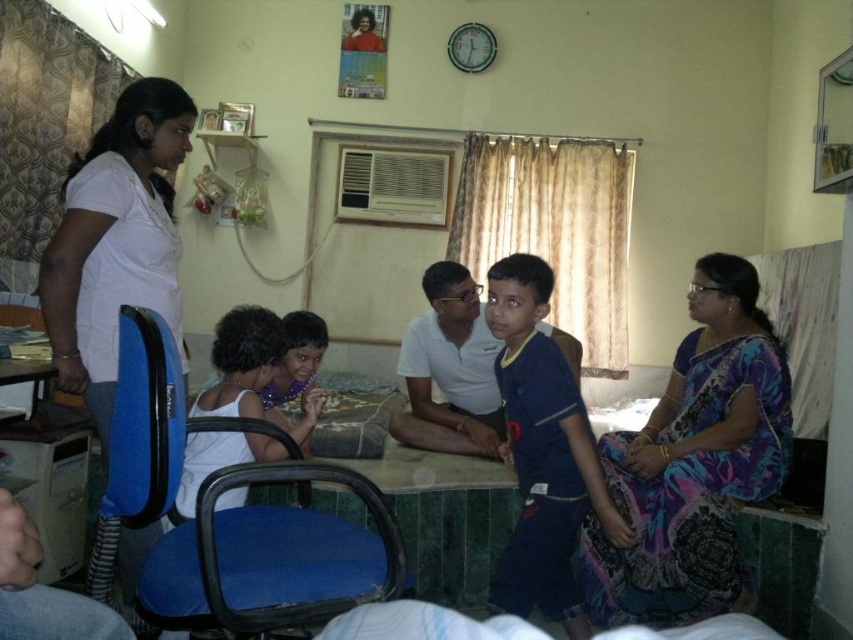
Who is shorter, printed silk saree at lower right or green marble table at center?

green marble table at center is shorter.

Does point (611, 476) come in front of point (430, 456)?

Yes, point (611, 476) is in front of point (430, 456).

You are a GUI agent. You are given a task and a screenshot of the screen. Output one action in this format:
    pyautogui.click(x=<x>, y=<y>)
    Task: Click on the printed silk saree at lower right
    Image resolution: width=853 pixels, height=640 pixels.
    Given the screenshot: What is the action you would take?
    pyautogui.click(x=694, y=461)

Is green marble table at center bigger than matte white shirt at lower left?

Correct, green marble table at center is larger in size than matte white shirt at lower left.

Which is more to the right, green marble table at center or matte white shirt at lower left?

From the viewer's perspective, green marble table at center appears more on the right side.

Between point (444, 477) and point (235, 376), which one is positioned behind?

The point (444, 477) is more distant.

You are a GUI agent. You are given a task and a screenshot of the screen. Output one action in this format:
    pyautogui.click(x=<x>, y=<y>)
    Task: Click on the green marble table at center
    The width and height of the screenshot is (853, 640).
    Given the screenshot: What is the action you would take?
    pyautogui.click(x=447, y=516)

Does white matte shirt at left appear under green marble table at center?

No.

Between point (78, 332) and point (440, 550), which one is positioned in front?

Point (78, 332) is in front.

The image size is (853, 640). Find the location of `white matte shirt at left`. white matte shirt at left is located at coordinates (115, 241).